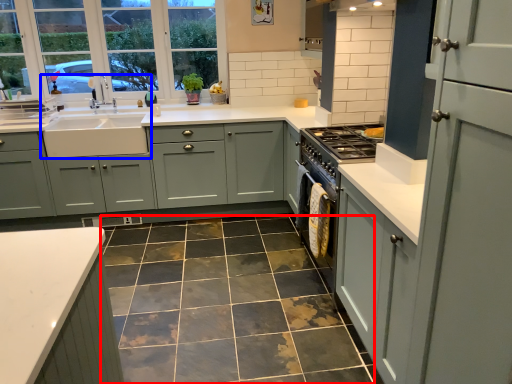
Question: Which object is closer to the camera taking this photo, ceramic tile (highlighted by a red box) or sink (highlighted by a blue box)?

Choices:
 (A) ceramic tile
 (B) sink

Answer: (A)